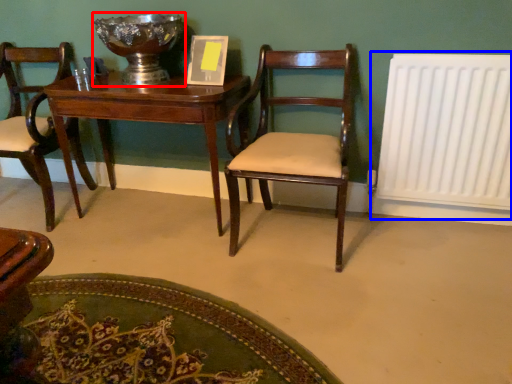
Question: Which of the following is the farthest to the observer, glass bowl (highlighted by a red box) or radiator (highlighted by a blue box)?

Choices:
 (A) glass bowl
 (B) radiator

Answer: (A)